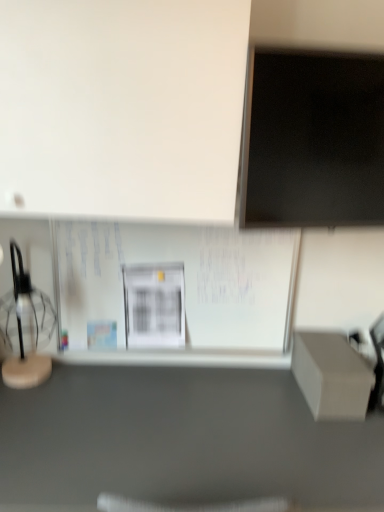
Question: Could you tell me if translucent glass table lamp at left is turned towards black matte computer monitor at upper right?

Choices:
 (A) yes
 (B) no

Answer: (B)

Question: Is translucent glass table lamp at left facing away from black matte computer monitor at upper right?

Choices:
 (A) yes
 (B) no

Answer: (B)

Question: Is translucent glass table lamp at left outside of black matte computer monitor at upper right?

Choices:
 (A) no
 (B) yes

Answer: (B)

Question: Is translucent glass table lamp at left directly adjacent to black matte computer monitor at upper right?

Choices:
 (A) no
 (B) yes

Answer: (A)

Question: From the image's perspective, is translucent glass table lamp at left located beneath black matte computer monitor at upper right?

Choices:
 (A) yes
 (B) no

Answer: (A)

Question: Can you confirm if translucent glass table lamp at left is smaller than black matte computer monitor at upper right?

Choices:
 (A) no
 (B) yes

Answer: (A)

Question: Is white paperboard at center behind translucent glass table lamp at left?

Choices:
 (A) yes
 (B) no

Answer: (A)

Question: Are white paperboard at center and translucent glass table lamp at left located far from each other?

Choices:
 (A) yes
 (B) no

Answer: (B)

Question: Is white paperboard at center oriented away from translucent glass table lamp at left?

Choices:
 (A) no
 (B) yes

Answer: (A)

Question: Is white paperboard at center touching translucent glass table lamp at left?

Choices:
 (A) no
 (B) yes

Answer: (A)

Question: Can you confirm if white paperboard at center is positioned to the left of translucent glass table lamp at left?

Choices:
 (A) yes
 (B) no

Answer: (B)

Question: Can you confirm if white paperboard at center is taller than translucent glass table lamp at left?

Choices:
 (A) no
 (B) yes

Answer: (B)

Question: Is black matte computer monitor at upper right facing towards matte gray box at lower right?

Choices:
 (A) yes
 (B) no

Answer: (B)